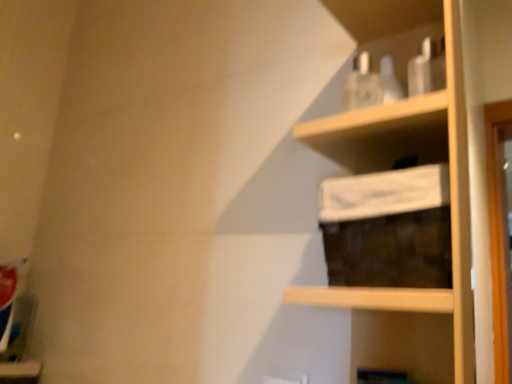
What do you see at coordinates (391, 167) in the screenshot? The width and height of the screenshot is (512, 384). I see `wooden shelf at upper right` at bounding box center [391, 167].

Where is `wooden shelf at upper right`? wooden shelf at upper right is located at coordinates (391, 167).

Image resolution: width=512 pixels, height=384 pixels. In order to click on wooden shelf at upper right in this screenshot , I will do `click(391, 167)`.